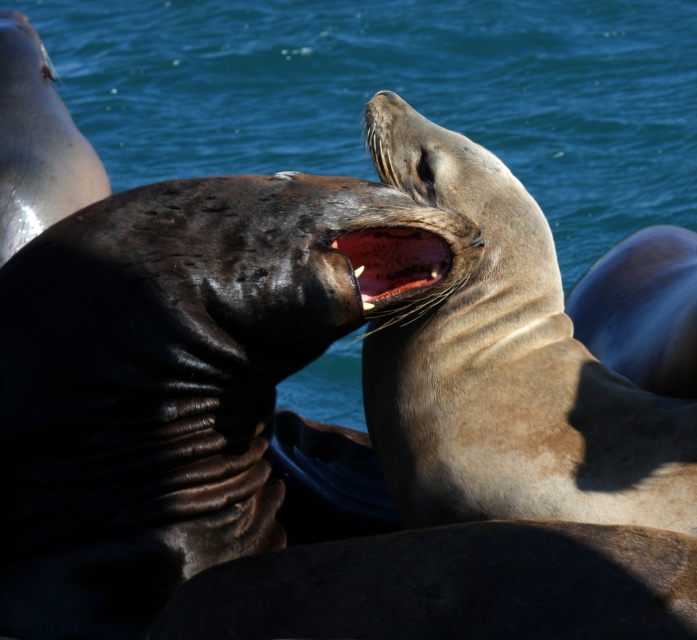
Question: Does smooth gray seal mouth at upper right appear under smooth pinkish-red gums at center?

Choices:
 (A) no
 (B) yes

Answer: (B)

Question: Is smooth gray seal mouth at upper right smaller than smooth pinkish-red gums at center?

Choices:
 (A) no
 (B) yes

Answer: (A)

Question: Which point appears closest to the camera in this image?

Choices:
 (A) (549, 268)
 (B) (375, 243)

Answer: (B)

Question: Is the position of smooth gray seal mouth at upper right more distant than that of smooth pinkish-red gums at center?

Choices:
 (A) no
 (B) yes

Answer: (A)

Question: Among these points, which one is farthest from the camera?

Choices:
 (A) (353, 253)
 (B) (457, 154)

Answer: (B)

Question: Among these points, which one is farthest from the camera?

Choices:
 (A) (352, 262)
 (B) (443, 436)

Answer: (A)